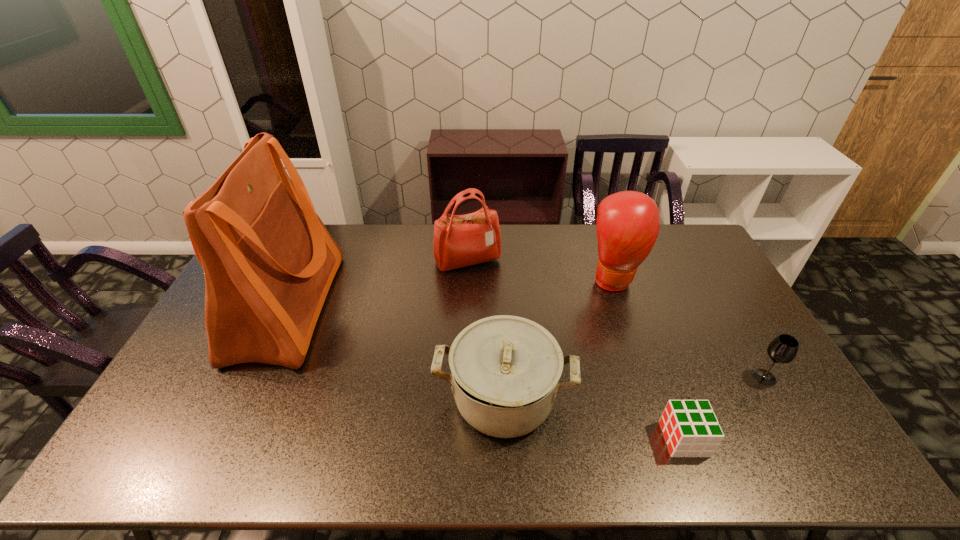
The width and height of the screenshot is (960, 540). Find the location of `vacant space located 0.290m on the front-facing side of the handbag`. vacant space located 0.290m on the front-facing side of the handbag is located at coordinates (465, 340).

Locate an element on the screen. free space located on the left of the third shortest object is located at coordinates (342, 398).

I want to click on free space located on the back of the wineglass, so click(x=720, y=302).

Locate an element on the screen. This screenshot has width=960, height=540. free space located 0.170m on the red face of the shortest object is located at coordinates (596, 439).

This screenshot has width=960, height=540. I want to click on free space located 0.090m on the red face of the shortest object, so click(628, 439).

You are a GUI agent. You are given a task and a screenshot of the screen. Output one action in this format:
    pyautogui.click(x=<x>, y=<y>)
    Task: Click on the free space located 0.120m on the red face of the shortest object
    The width and height of the screenshot is (960, 540).
    Given the screenshot: What is the action you would take?
    pyautogui.click(x=616, y=439)

Identify the location of shopping bag at the far edge. (268, 260).

Where is `boxing glove that is at the far edge`? The width and height of the screenshot is (960, 540). boxing glove that is at the far edge is located at coordinates (628, 222).

Where is `handbag at the far edge`? handbag at the far edge is located at coordinates (459, 240).

I want to click on saucepan that is at the near edge, so click(x=506, y=369).